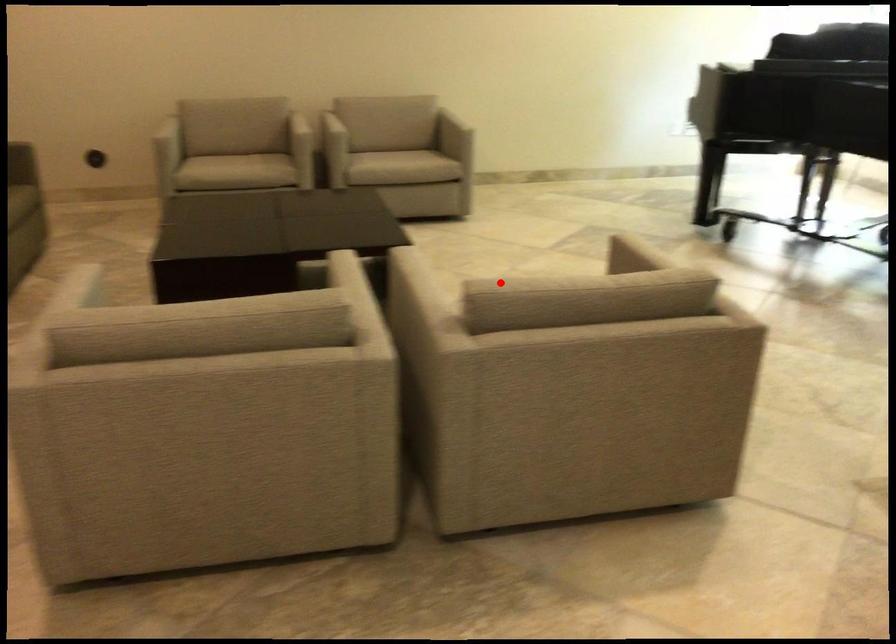
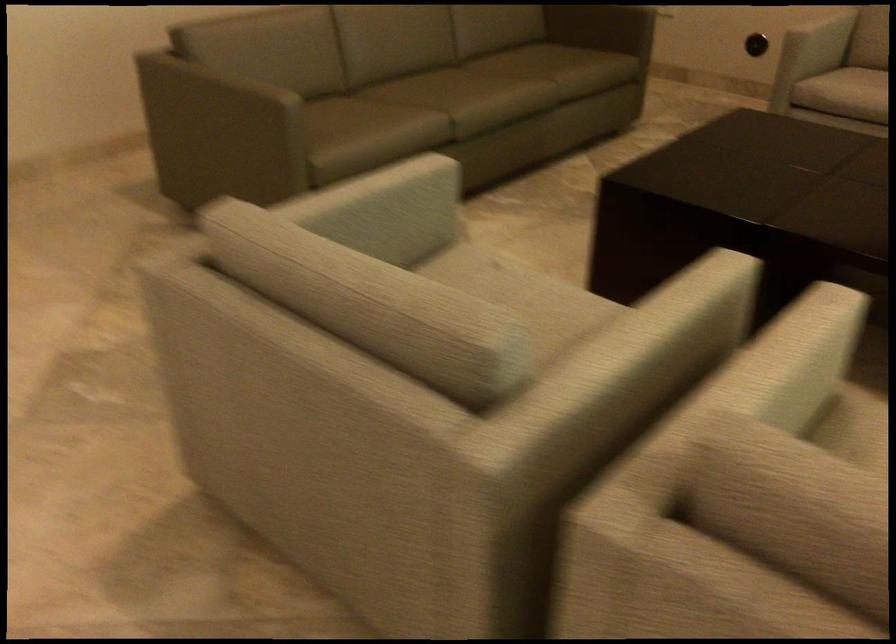
The point at the highlighted location is marked in the first image. Where is the corresponding point in the second image?

(806, 468)